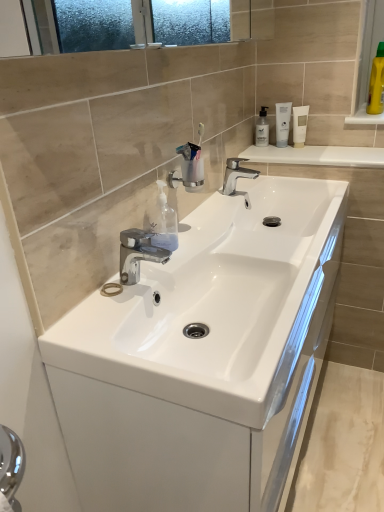
Locate an element on the screen. free space in front of white matte tube at upper right, which is the 3th mouthwash in right-to-left order is located at coordinates (294, 155).